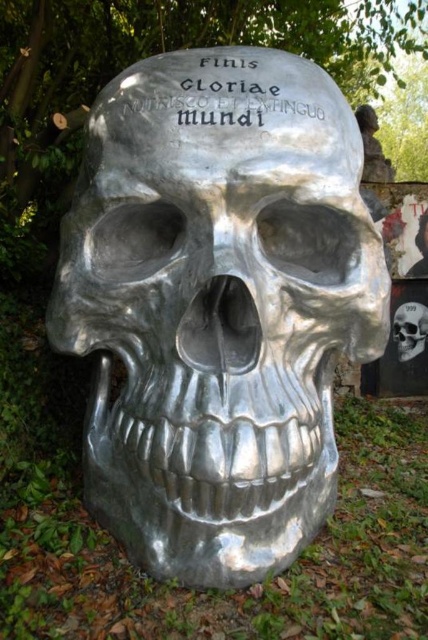
What are the coordinates of the shiny silver skull at center?

The shiny silver skull at center is located at point (410, 330).